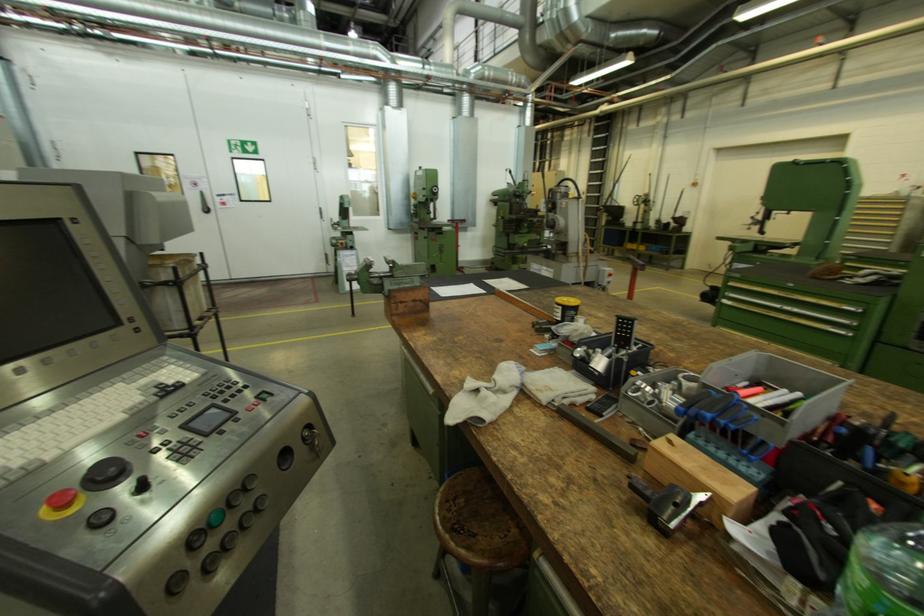
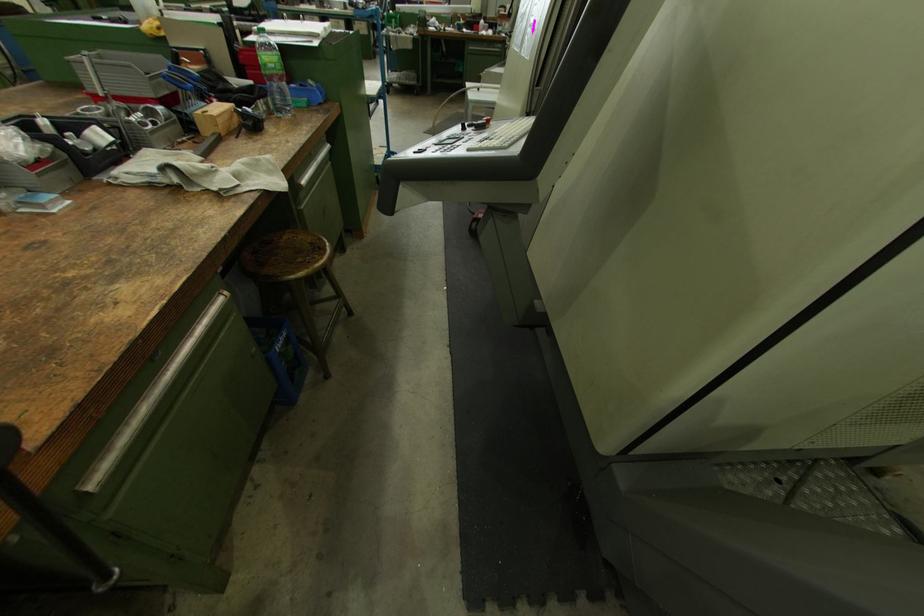
Locate, in the second image, the point that corresponds to [697,438] in the first image.

(192, 113)